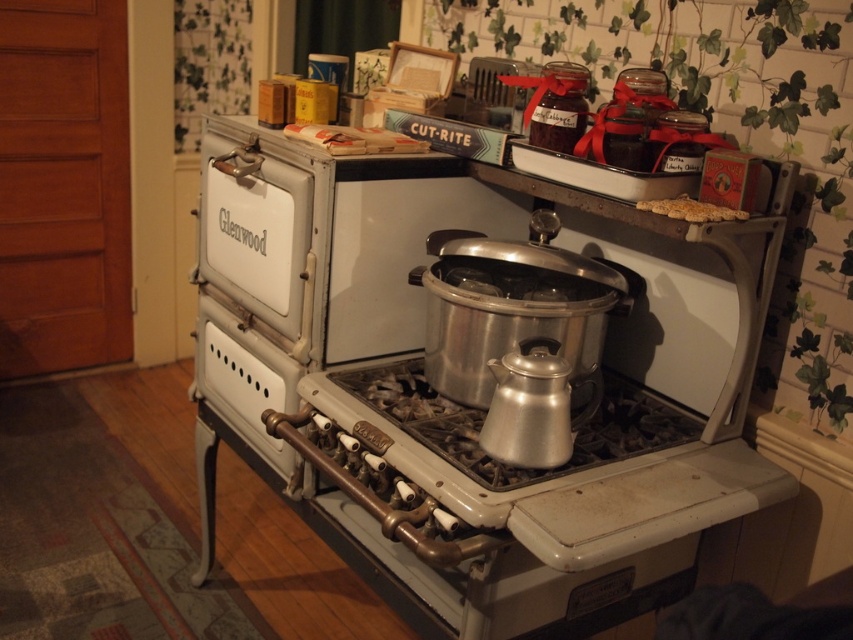
Does silver metallic oven at center have a greater width compared to brown crumbly bread at upper center?

Yes.

Is point (698, 408) closer to camera compared to point (666, 205)?

No, (698, 408) is behind (666, 205).

Does point (670, 353) come closer to viewer compared to point (654, 208)?

No, it is behind (654, 208).

Find the location of a particular element. Image resolution: width=853 pixels, height=640 pixels. silver metallic oven at center is located at coordinates tap(474, 378).